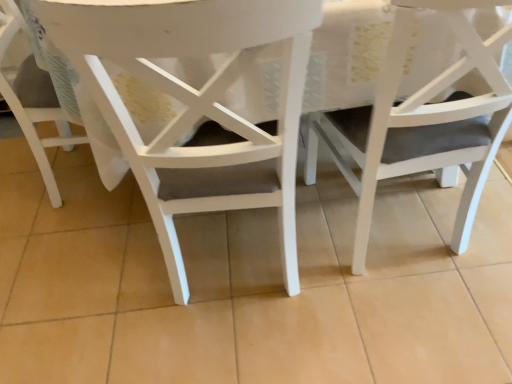
Question: Does point (38, 119) appear closer or farther from the camera than point (315, 137)?

Choices:
 (A) closer
 (B) farther

Answer: (A)

Question: From the image's perspective, is white matte chair at lower left, marked as the third chair in a right-to-left arrangement, located above or below matte white chair at center, the 3th chair from the left?

Choices:
 (A) above
 (B) below

Answer: (A)

Question: Considering the real-world distances, which object is closest to the white matte chair at center, which appears as the second chair when viewed from the left?

Choices:
 (A) matte white chair at center, the 3th chair from the left
 (B) white matte chair at lower left, which is the first chair in left-to-right order

Answer: (A)

Question: Which object is positioned farthest from the white matte chair at lower left, which is the first chair in left-to-right order?

Choices:
 (A) matte white chair at center, which is counted as the 1th chair, starting from the right
 (B) white matte chair at center, which appears as the second chair when viewed from the left

Answer: (A)